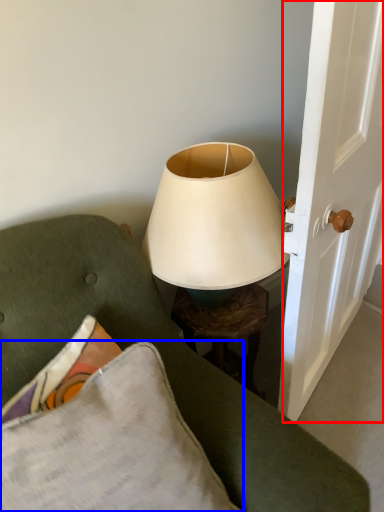
Question: Which object appears farthest to the camera in this image, screen door (highlighted by a red box) or pillow (highlighted by a blue box)?

Choices:
 (A) screen door
 (B) pillow

Answer: (A)